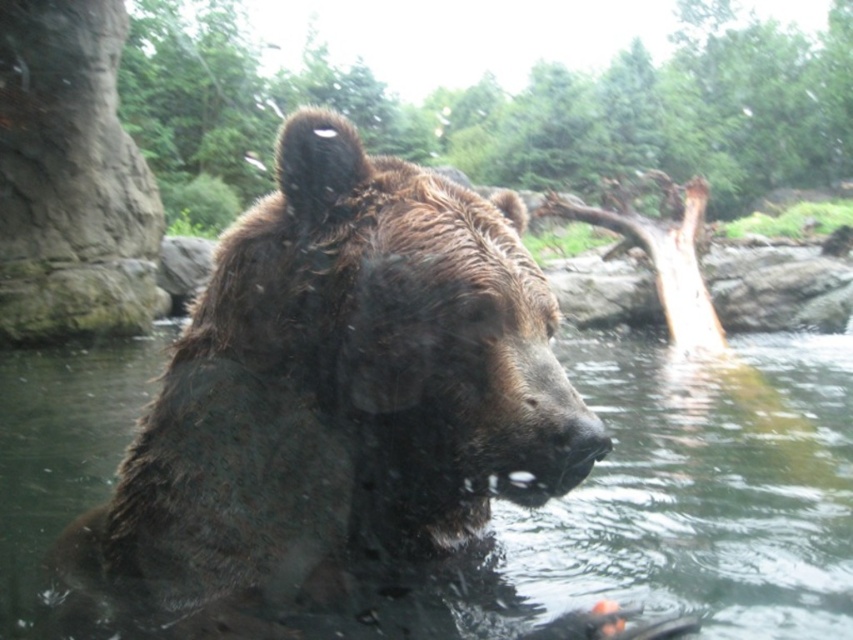
You are standing 5 feet away from the point marked at coordinates point (155,577). Can you safely approach the point without getting too close to the bear?

The distance of point (155,577) from viewer is 4.86 feet, so you are currently 5 feet away from it. Since the distance is almost the same, you can approach the point but must be cautious as you are very close to the bear.